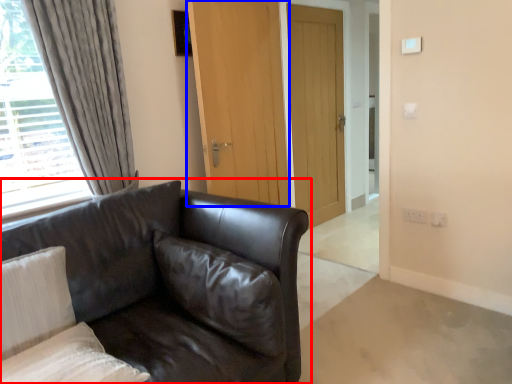
Question: Which object is further to the camera taking this photo, studio couch (highlighted by a red box) or door (highlighted by a blue box)?

Choices:
 (A) studio couch
 (B) door

Answer: (B)